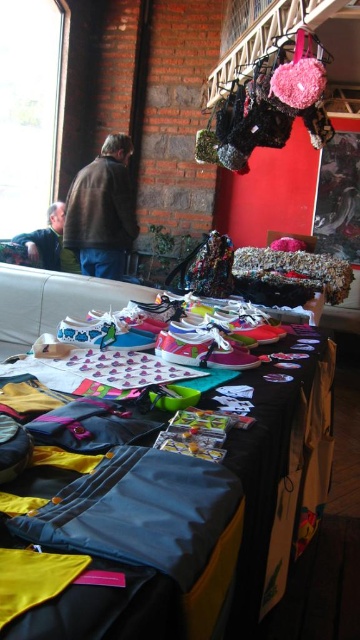
You are a customer at the market and want to pick up both the shiny fabric bags at center and the brown leather jacket at center. Which item will you need to reach for first?

The shiny fabric bags at center are closer to you than the brown leather jacket at center, so you should reach for the shiny fabric bags at center first.

You are standing at the entrance of the market and want to reach the item at point (x=70, y=257). There is an obstacle at point (x=83, y=269). Will you need to go around the obstacle to reach your destination?

Yes, you will need to go around the obstacle at point (x=83, y=269) because it is in front of point (x=70, y=257), blocking the direct path.